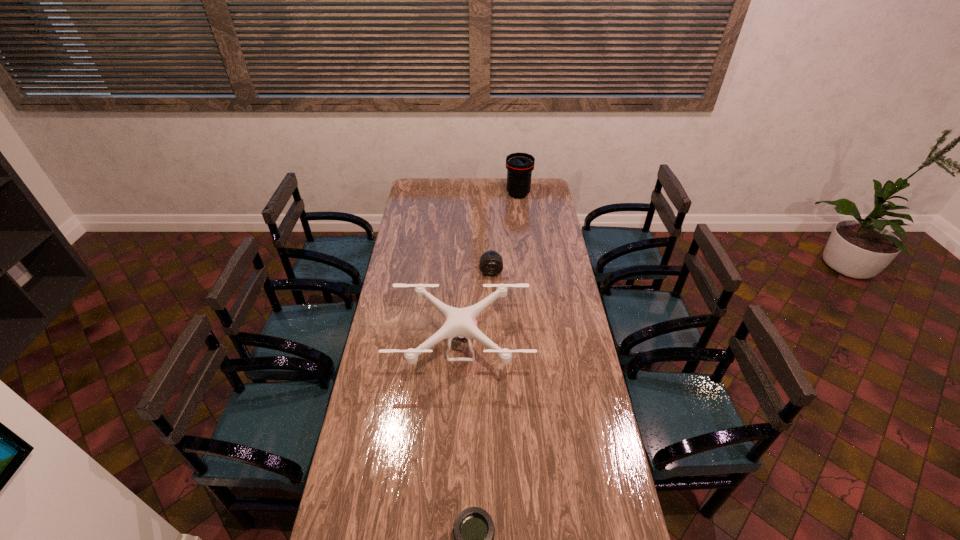
Where is `object situated at the left edge`? The width and height of the screenshot is (960, 540). object situated at the left edge is located at coordinates (459, 323).

The width and height of the screenshot is (960, 540). What are the coordinates of `object present at the right edge` in the screenshot? It's located at (519, 166).

Image resolution: width=960 pixels, height=540 pixels. Identify the location of object positioned at the far right corner. (519, 166).

Identify the location of free space at the far edge of the desktop. (475, 189).

This screenshot has width=960, height=540. Find the location of `free space at the left edge of the desktop`. free space at the left edge of the desktop is located at coordinates tap(418, 226).

You are a GUI agent. You are given a task and a screenshot of the screen. Output one action in this format:
    pyautogui.click(x=<x>, y=<y>)
    Task: Click on the free space at the right edge of the desktop
    Image resolution: width=960 pixels, height=540 pixels.
    Given the screenshot: What is the action you would take?
    pyautogui.click(x=558, y=236)

I want to click on vacant space at the far left corner of the desktop, so click(x=428, y=194).

Find the location of `object that is the second closest to the second nearest object`. object that is the second closest to the second nearest object is located at coordinates (474, 531).

I want to click on object that ranks as the third closest to the second nearest object, so click(519, 166).

The image size is (960, 540). I want to click on the second closest telephoto lens to the nearest object, so click(519, 166).